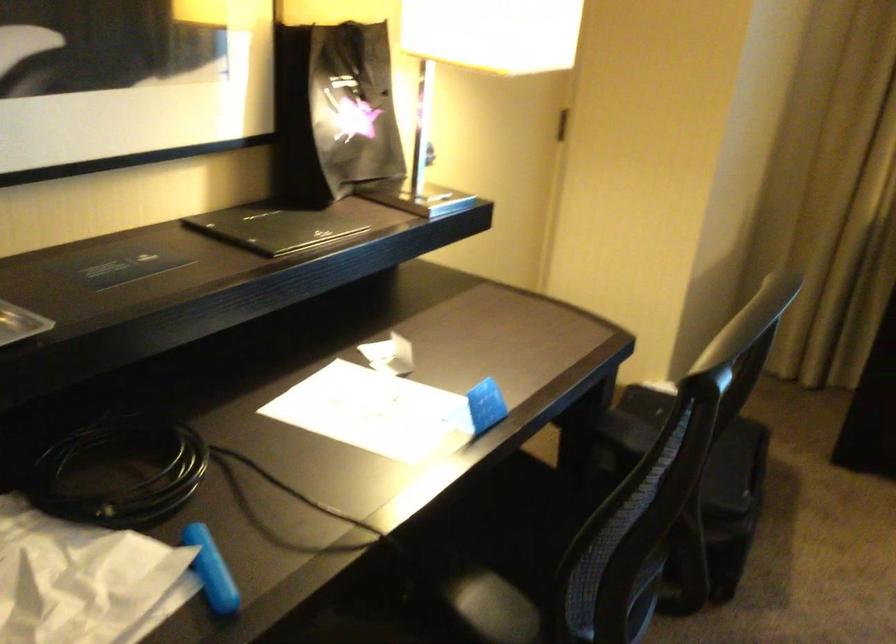
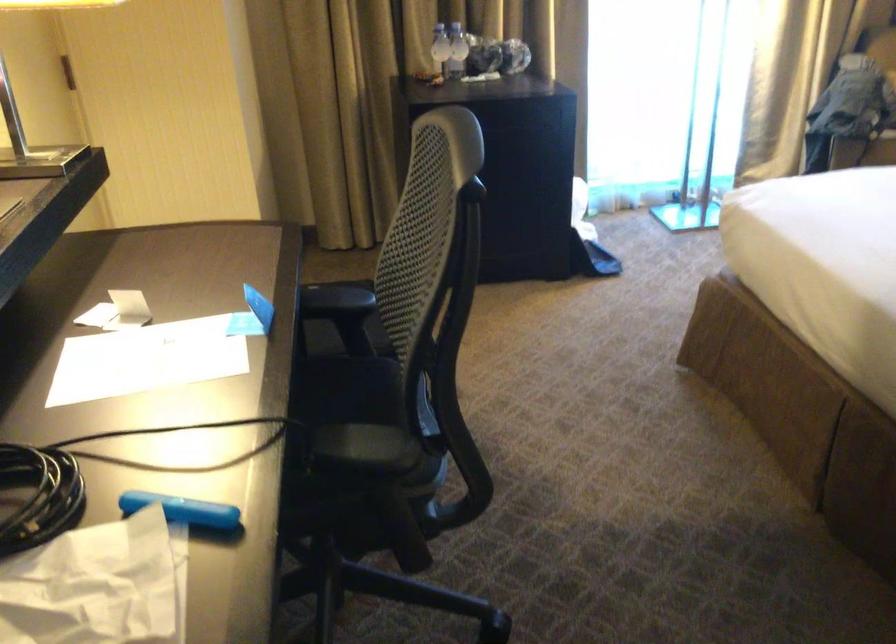
Question: How did the camera likely rotate?

Choices:
 (A) Left
 (B) Right
 (C) Up
 (D) Down

Answer: (B)